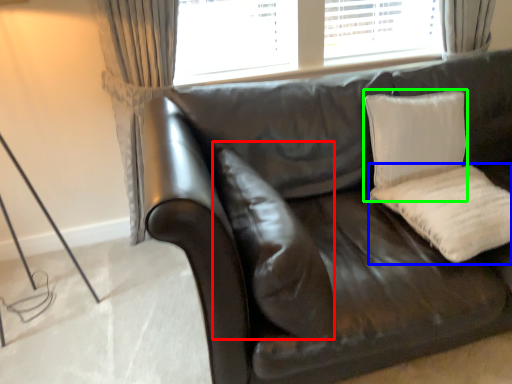
Question: Which object is positioned farthest from pillow (highlighted by a red box)? Select from pillow (highlighted by a blue box) and pillow (highlighted by a green box).

Choices:
 (A) pillow
 (B) pillow

Answer: (B)